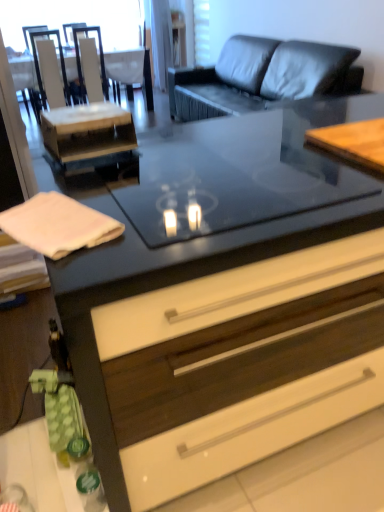
Question: Does white fabric armchair at upper center, which is counted as the 3th armchair, starting from the left, have a lesser width compared to matte black drawer at center?

Choices:
 (A) no
 (B) yes

Answer: (B)

Question: From a real-world perspective, is white fabric armchair at upper center, which is counted as the 3th armchair, starting from the left, positioned over matte black drawer at center based on gravity?

Choices:
 (A) no
 (B) yes

Answer: (B)

Question: Is white fabric armchair at upper center, arranged as the 1th armchair when viewed from the right, located outside matte black drawer at center?

Choices:
 (A) yes
 (B) no

Answer: (A)

Question: Is white fabric armchair at upper center, which is counted as the 3th armchair, starting from the left, looking in the opposite direction of matte black drawer at center?

Choices:
 (A) yes
 (B) no

Answer: (B)

Question: Would you say white fabric armchair at upper center, which is counted as the 3th armchair, starting from the left, contains matte black drawer at center?

Choices:
 (A) yes
 (B) no

Answer: (B)

Question: From the image's perspective, is white glossy armchair at upper left, which is counted as the 2th armchair, starting from the right, located above or below white glossy armchair at upper left, the first armchair when ordered from left to right?

Choices:
 (A) above
 (B) below

Answer: (A)

Question: Is point (89, 30) positioned closer to the camera than point (49, 30)?

Choices:
 (A) farther
 (B) closer

Answer: (A)

Question: Is white glossy armchair at upper left, which is counted as the 2th armchair, starting from the right, to the left or to the right of white glossy armchair at upper left, the first armchair when ordered from left to right, in the image?

Choices:
 (A) right
 (B) left

Answer: (A)

Question: Is white glossy armchair at upper left, placed as the 2th armchair when sorted from left to right, in front of or behind white glossy armchair at upper left, which ranks as the 3th armchair in right-to-left order, in the image?

Choices:
 (A) behind
 (B) front

Answer: (A)

Question: Is point (54, 51) closer or farther from the camera than point (72, 35)?

Choices:
 (A) farther
 (B) closer

Answer: (B)

Question: From the image's perspective, is white glossy armchair at upper left, the first armchair when ordered from left to right, above or below white glossy armchair at upper left, placed as the 2th armchair when sorted from left to right?

Choices:
 (A) below
 (B) above

Answer: (A)

Question: From a real-world perspective, is white glossy armchair at upper left, the first armchair when ordered from left to right, physically located above or below white glossy armchair at upper left, placed as the 2th armchair when sorted from left to right?

Choices:
 (A) above
 (B) below

Answer: (A)

Question: Looking at the image, does white glossy armchair at upper left, which ranks as the 3th armchair in right-to-left order, seem bigger or smaller compared to white glossy armchair at upper left, placed as the 2th armchair when sorted from left to right?

Choices:
 (A) big
 (B) small

Answer: (B)

Question: Is white glossy armchair at upper left, the first armchair when ordered from left to right, wider or thinner than matte black drawer at center?

Choices:
 (A) thin
 (B) wide

Answer: (A)

Question: Considering the positions of point (36, 62) and point (269, 262), is point (36, 62) closer or farther from the camera than point (269, 262)?

Choices:
 (A) closer
 (B) farther

Answer: (B)